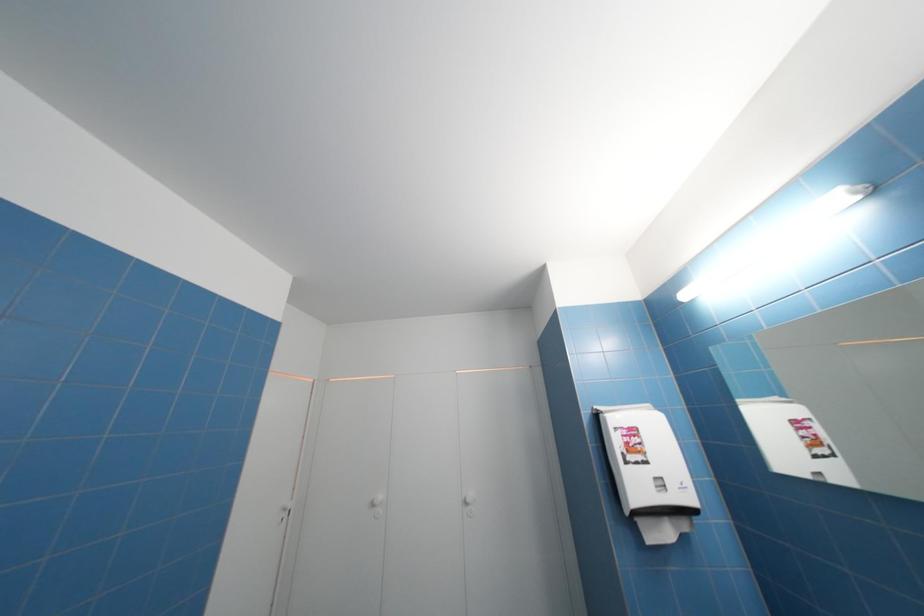
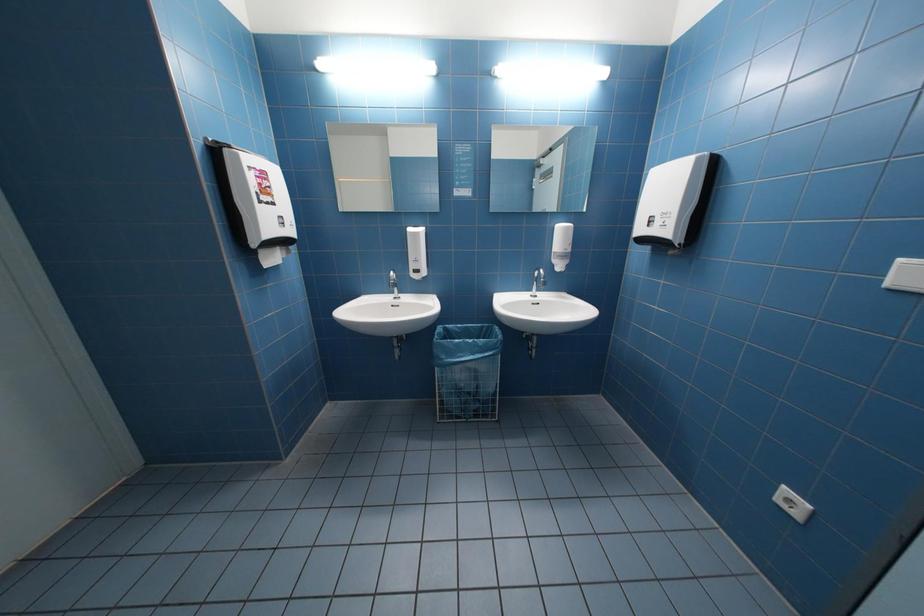
Question: The camera is either moving clockwise (left) or counter-clockwise (right) around the object. The first image is from the beginning of the video and the second image is from the end. Is the camera moving left or right when shooting the video?

Choices:
 (A) Left
 (B) Right

Answer: (A)